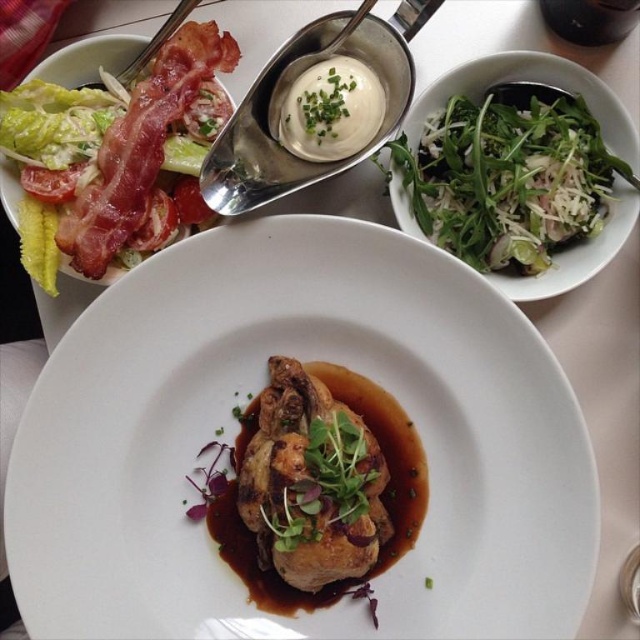
Who is lower down, shiny red bacon at upper left or white creamy dip at center?

Positioned lower is shiny red bacon at upper left.

What do you see at coordinates (118, 156) in the screenshot? I see `shiny red bacon at upper left` at bounding box center [118, 156].

Locate an element on the screen. The width and height of the screenshot is (640, 640). shiny red bacon at upper left is located at coordinates (118, 156).

Locate an element on the screen. The height and width of the screenshot is (640, 640). shiny red bacon at upper left is located at coordinates (118, 156).

Measure the distance from green leafy salad at upper right to satin silver spoon at upper center.

A distance of 7.68 inches exists between green leafy salad at upper right and satin silver spoon at upper center.

Which is more to the left, green leafy salad at upper right or satin silver spoon at upper center?

satin silver spoon at upper center is more to the left.

Where is `green leafy salad at upper right`? The image size is (640, 640). green leafy salad at upper right is located at coordinates (508, 179).

Identify the location of green leafy salad at upper right. (508, 179).

Which is more to the left, shiny red bacon at upper left or green leafy salad at upper right?

shiny red bacon at upper left

In the scene shown: Is shiny red bacon at upper left smaller than green leafy salad at upper right?

No.

Is point (29, 102) positioned after point (428, 125)?

No, (29, 102) is in front of (428, 125).

Image resolution: width=640 pixels, height=640 pixels. In order to click on shiny red bacon at upper left in this screenshot , I will do `click(118, 156)`.